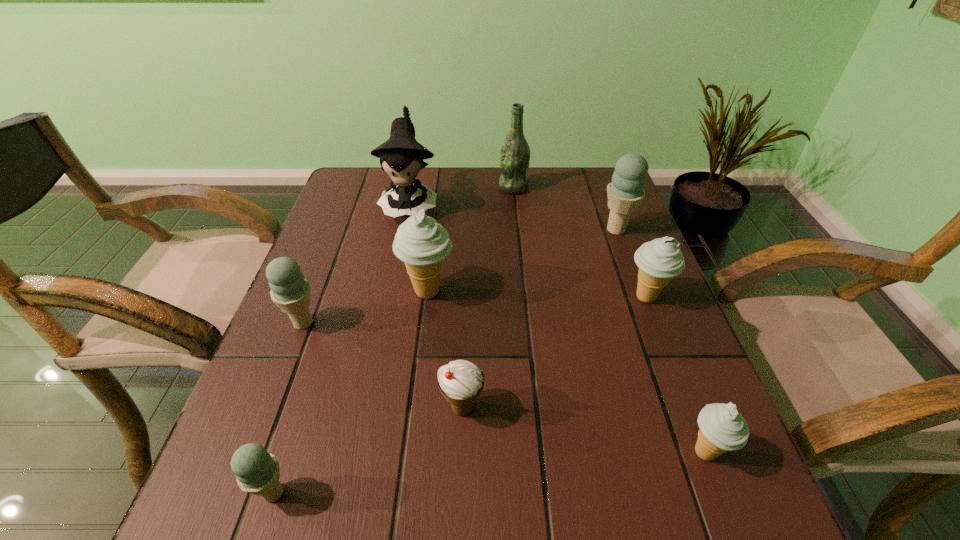
Find the location of `vacant space located on the front of the second biggest beige icecream`. vacant space located on the front of the second biggest beige icecream is located at coordinates (710, 465).

This screenshot has height=540, width=960. Find the location of `vacant space situated on the right of the second smallest blue ice cream`. vacant space situated on the right of the second smallest blue ice cream is located at coordinates (346, 323).

The height and width of the screenshot is (540, 960). I want to click on free region located on the right of the white icecream, so click(x=616, y=408).

I want to click on blank area located 0.340m on the back of the second nearest ice cream, so click(x=642, y=288).

Where is `vacant region located on the right of the nearest object`? This screenshot has height=540, width=960. vacant region located on the right of the nearest object is located at coordinates (525, 493).

The height and width of the screenshot is (540, 960). Find the location of `doll situated at the far edge`. doll situated at the far edge is located at coordinates 401,156.

At what (x,y) coordinates should I click in order to perform the action: click on beer bottle at the far edge. Please return your answer as a coordinate pair (x, y). The image size is (960, 540). Looking at the image, I should click on (515, 153).

Locate an element on the screen. The height and width of the screenshot is (540, 960). object situated at the near edge is located at coordinates (257, 472).

In order to click on doll that is at the left edge in this screenshot , I will do `click(401, 156)`.

I want to click on object located at the far left corner, so click(401, 156).